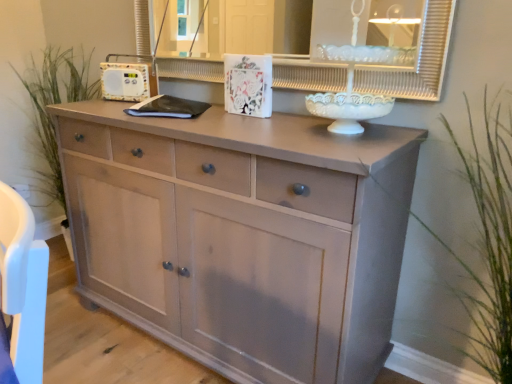
Question: Should I look upward or downward to see white glossy medicine cabinet at upper center?

Choices:
 (A) up
 (B) down

Answer: (A)

Question: Can you confirm if matte light wood chest of drawers at center is positioned to the left of white glossy medicine cabinet at upper center?

Choices:
 (A) yes
 (B) no

Answer: (A)

Question: Is the position of matte light wood chest of drawers at center more distant than that of white glossy medicine cabinet at upper center?

Choices:
 (A) no
 (B) yes

Answer: (A)

Question: Can you confirm if matte light wood chest of drawers at center is thinner than white glossy medicine cabinet at upper center?

Choices:
 (A) yes
 (B) no

Answer: (B)

Question: From a real-world perspective, is matte light wood chest of drawers at center under white glossy medicine cabinet at upper center?

Choices:
 (A) no
 (B) yes

Answer: (B)

Question: Is matte light wood chest of drawers at center smaller than white glossy medicine cabinet at upper center?

Choices:
 (A) yes
 (B) no

Answer: (B)

Question: Does matte light wood chest of drawers at center have a greater height compared to white glossy medicine cabinet at upper center?

Choices:
 (A) yes
 (B) no

Answer: (A)

Question: Is green grass at left, positioned as the 1th plant in back-to-front order, at the back of white glossy medicine cabinet at upper center?

Choices:
 (A) no
 (B) yes

Answer: (A)

Question: Does white glossy medicine cabinet at upper center have a lesser height compared to green grass at left, the first plant in the left-to-right sequence?

Choices:
 (A) yes
 (B) no

Answer: (A)

Question: Is green grass at left, placed as the second plant when sorted from front to back, surrounded by white glossy medicine cabinet at upper center?

Choices:
 (A) no
 (B) yes

Answer: (A)

Question: Are white glossy medicine cabinet at upper center and green grass at left, the first plant in the left-to-right sequence, far apart?

Choices:
 (A) yes
 (B) no

Answer: (A)

Question: Can you confirm if white glossy medicine cabinet at upper center is wider than green grass at left, placed as the second plant when sorted from front to back?

Choices:
 (A) yes
 (B) no

Answer: (B)

Question: Is white glossy medicine cabinet at upper center bigger than green grass at left, positioned as the 1th plant in back-to-front order?

Choices:
 (A) yes
 (B) no

Answer: (B)

Question: From a real-world perspective, does matte light wood chest of drawers at center stand above green grass at left, the second plant when ordered from right to left?

Choices:
 (A) no
 (B) yes

Answer: (A)